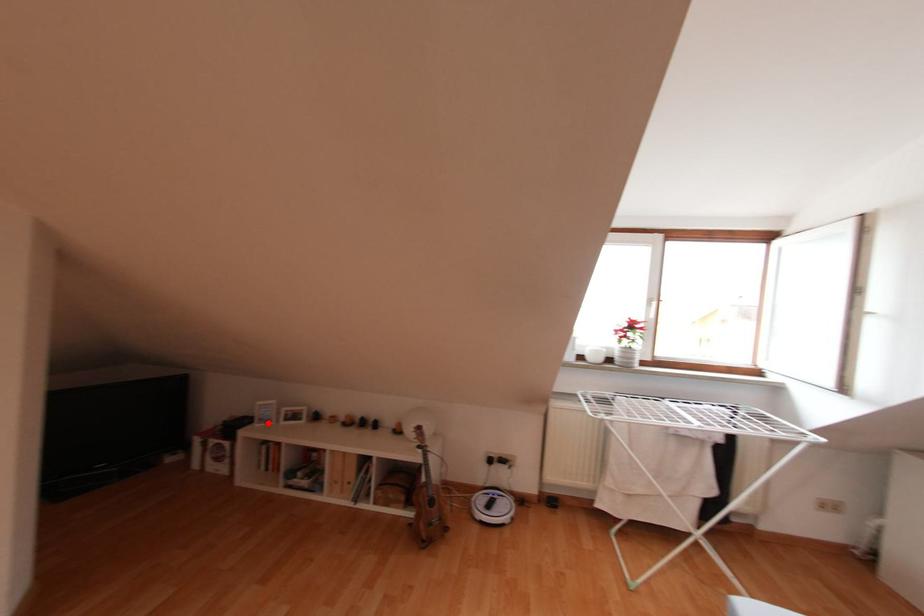
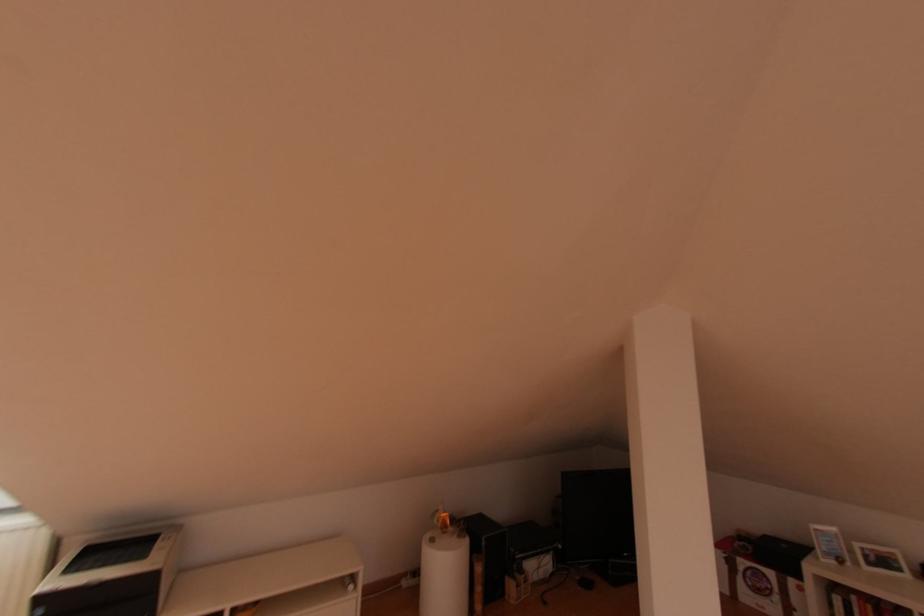
Locate, in the second image, the point that corresponds to the highlighted location in the first image.

(840, 562)